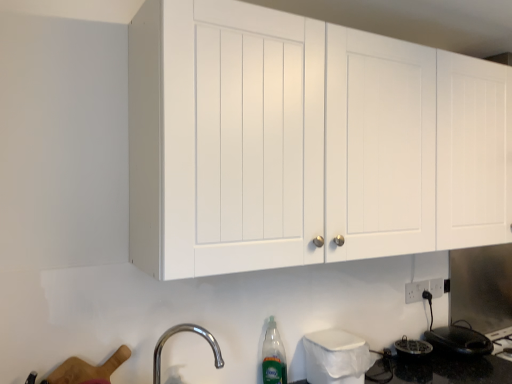
Question: In terms of size, does translucent plastic bottle at lower center appear bigger or smaller than black glossy electric kettle at lower right, which appears as the first appliance when viewed from the right?

Choices:
 (A) small
 (B) big

Answer: (A)

Question: Which is correct: translucent plastic bottle at lower center is inside black glossy electric kettle at lower right, which ranks as the first appliance in back-to-front order, or outside of it?

Choices:
 (A) inside
 (B) outside

Answer: (B)

Question: Estimate the real-world distances between objects in this image. Which object is farther from the translucent plastic bottle at lower center?

Choices:
 (A) chrome metallic faucet at lower left
 (B) white plastic trash can at lower center, arranged as the second appliance when viewed from the right
 (C) black glossy electric kettle at lower right, which ranks as the second appliance in left-to-right order
 (D) white matte cabinet at upper center

Answer: (C)

Question: Based on their relative distances, which object is farther from the translucent plastic bottle at lower center?

Choices:
 (A) chrome metallic faucet at lower left
 (B) white plastic trash can at lower center, which is the 1th appliance in left-to-right order
 (C) white matte cabinet at upper center
 (D) black glossy electric kettle at lower right, which ranks as the second appliance in left-to-right order

Answer: (D)